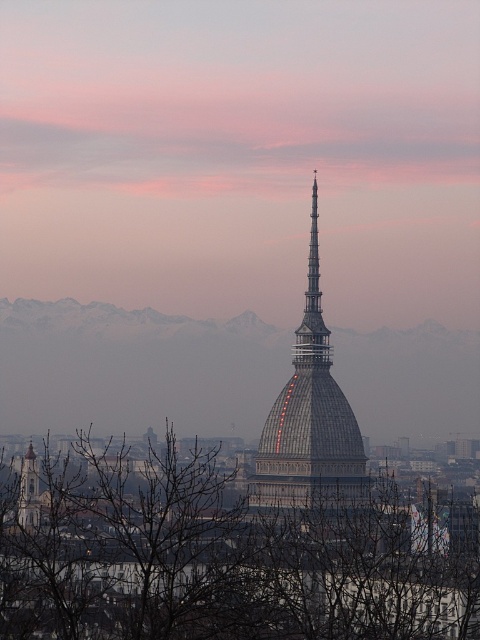
You are standing in front of the gray stone tower at center and want to take a photo of it without the bare branches at center blocking the view. Which direction should you move to ensure the branches are no longer in front of the tower?

The bare branches at center are to the left of the gray stone tower at center. To avoid them blocking the view, move to the right side of the tower so the branches are no longer in front.

You are standing in front of the dome building and notice two points marked on the structure. The first point is at coordinates point (355,561) and the second at point (22,518). Which of these points is nearer to your current position?

Point (355,561) is closer to the viewer than point (22,518).